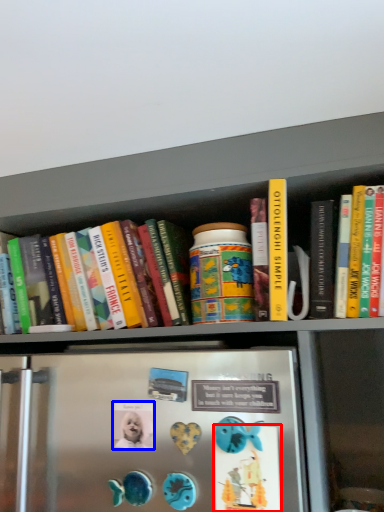
Question: Which object appears farthest to the camera in this image, button (highlighted by a red box) or button (highlighted by a blue box)?

Choices:
 (A) button
 (B) button

Answer: (B)